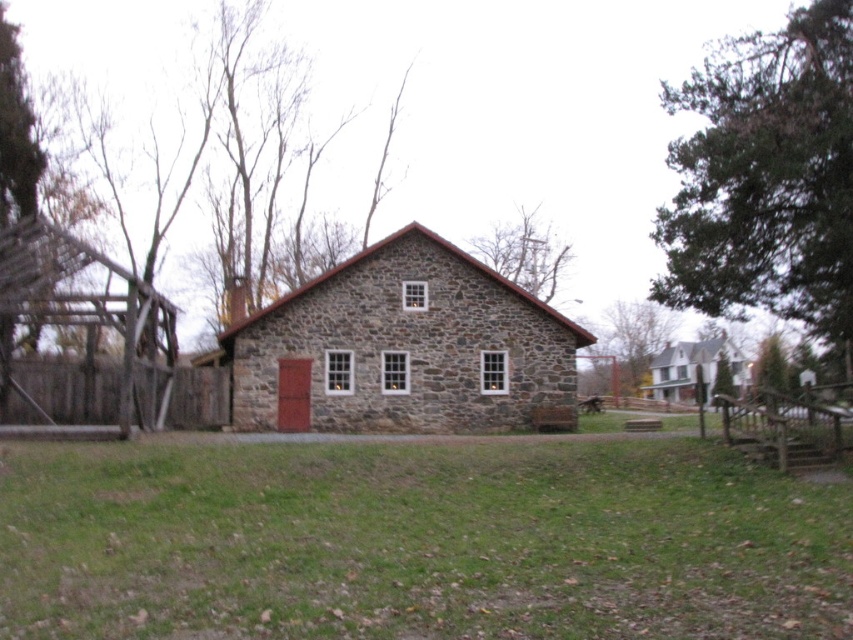
Question: Does green grass at center come behind brown wooden fence at left?

Choices:
 (A) no
 (B) yes

Answer: (A)

Question: Which point is closer to the camera taking this photo?

Choices:
 (A) (78, 374)
 (B) (801, 596)
 (C) (836, 419)

Answer: (B)

Question: Which point is closer to the camera?

Choices:
 (A) (683, 353)
 (B) (740, 429)
 (C) (59, 492)

Answer: (C)

Question: Is stone barn at center positioned in front of wooden fence at lower right?

Choices:
 (A) yes
 (B) no

Answer: (B)

Question: Which of the following is the closest to the observer?

Choices:
 (A) white stone barn at center
 (B) green grass at center
 (C) stone barn at center

Answer: (B)

Question: Does brown wooden fence at left have a larger size compared to white stone barn at center?

Choices:
 (A) yes
 (B) no

Answer: (B)